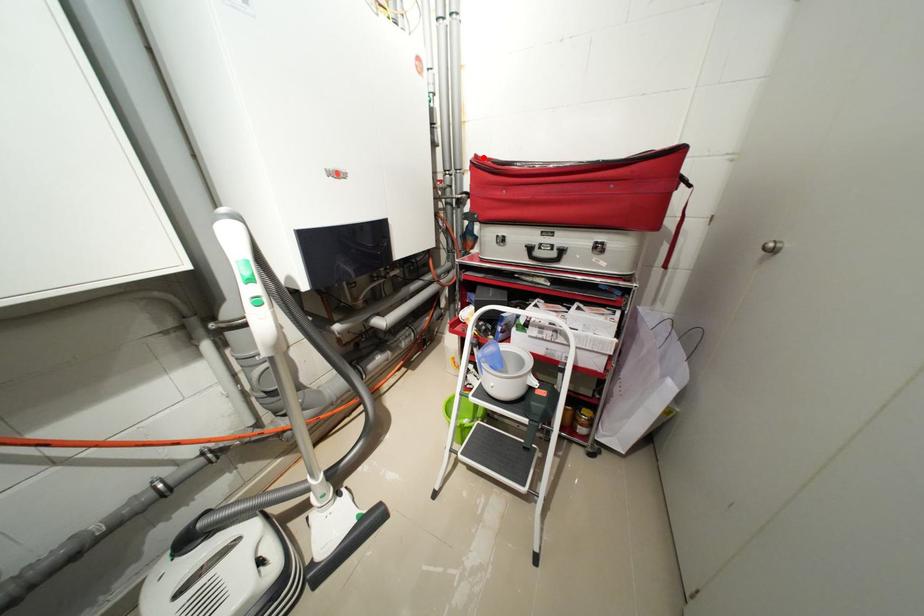
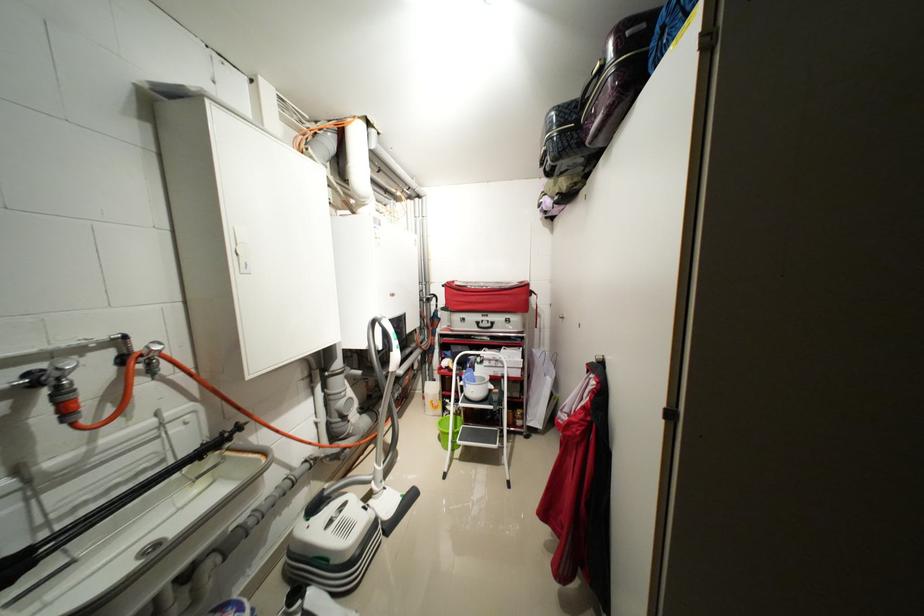
Where in the second image is the point corresponding to the highlighted location from the first image?

(455, 284)